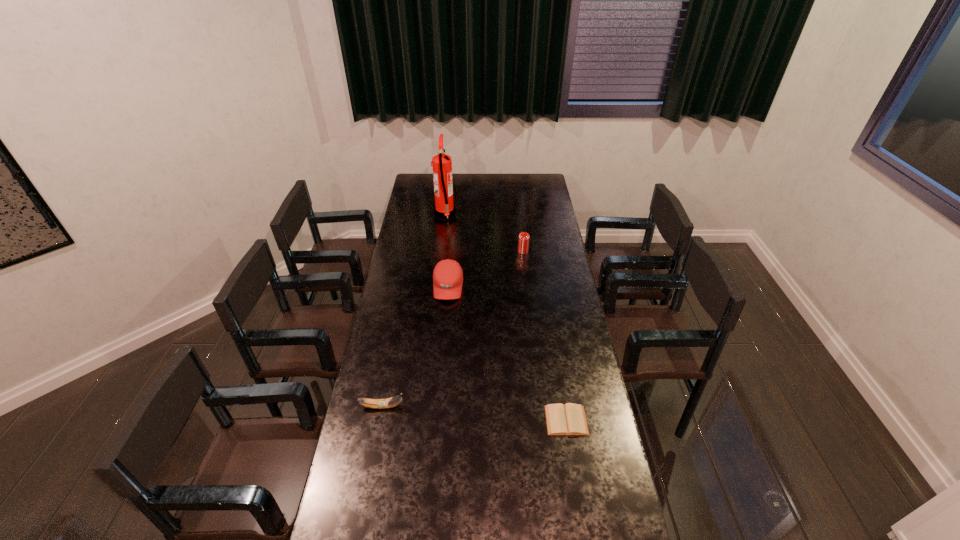
You are a GUI agent. You are given a task and a screenshot of the screen. Output one action in this format:
    pyautogui.click(x=<x>, y=<y>)
    Task: Click on the vacant space that's between the shortest object and the farthest object
    
    Given the screenshot: What is the action you would take?
    pyautogui.click(x=506, y=318)

This screenshot has height=540, width=960. Find the location of `vacant point located between the leftmost object and the diary`. vacant point located between the leftmost object and the diary is located at coordinates (474, 413).

Locate an element on the screen. Image resolution: width=960 pixels, height=540 pixels. unoccupied area between the banana and the shortest object is located at coordinates (474, 413).

Identify the location of vacant area that lies between the tallest object and the diary. (506, 318).

Locate an element on the screen. blank region between the diary and the third farthest object is located at coordinates (507, 353).

Where is `vacant point located between the diary and the cap`? This screenshot has width=960, height=540. vacant point located between the diary and the cap is located at coordinates (507, 353).

Identify the location of vacant region between the diary and the third nearest object. (507, 353).

Identify which object is the second closest to the diary. Please provide its 2D coordinates. Your answer should be formatted as a tuple, i.e. [(x, y)], where the tuple contains the x and y coordinates of a point satisfying the conditions above.

[(447, 276)]

Identify which object is located as the fourth nearest to the leftmost object. Please provide its 2D coordinates. Your answer should be formatted as a tuple, i.e. [(x, y)], where the tuple contains the x and y coordinates of a point satisfying the conditions above.

[(444, 209)]

I want to click on free space that satisfies the following two spatial constraints: 1. on the front-facing side of the third farthest object; 2. on the peel of the leftmost object, so click(439, 407).